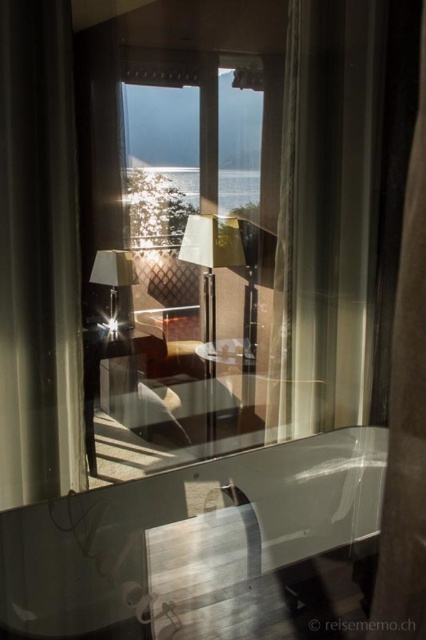
Question: Which of these objects is positioned farthest from the satin white curtain at right?

Choices:
 (A) brown fabric curtain at right
 (B) satin beige curtain at left
 (C) transparent glass table at center

Answer: (B)

Question: Can you confirm if brown fabric curtain at right is smaller than matte glass table at center?

Choices:
 (A) yes
 (B) no

Answer: (B)

Question: Is matte gold lamp at center thinner than matte glass table at center?

Choices:
 (A) no
 (B) yes

Answer: (B)

Question: Estimate the real-world distances between objects in this image. Which object is farther from the matte wooden table at center?

Choices:
 (A) satin beige curtain at left
 (B) matte gold lamp at center
 (C) satin white curtain at right
 (D) matte silver lamp at center

Answer: (C)

Question: Observing the image, what is the correct spatial positioning of transparent glass table at center in reference to matte wooden table at center?

Choices:
 (A) below
 (B) above

Answer: (A)

Question: Which of the following is the closest to the observer?

Choices:
 (A) (397, 600)
 (B) (270, 404)

Answer: (A)